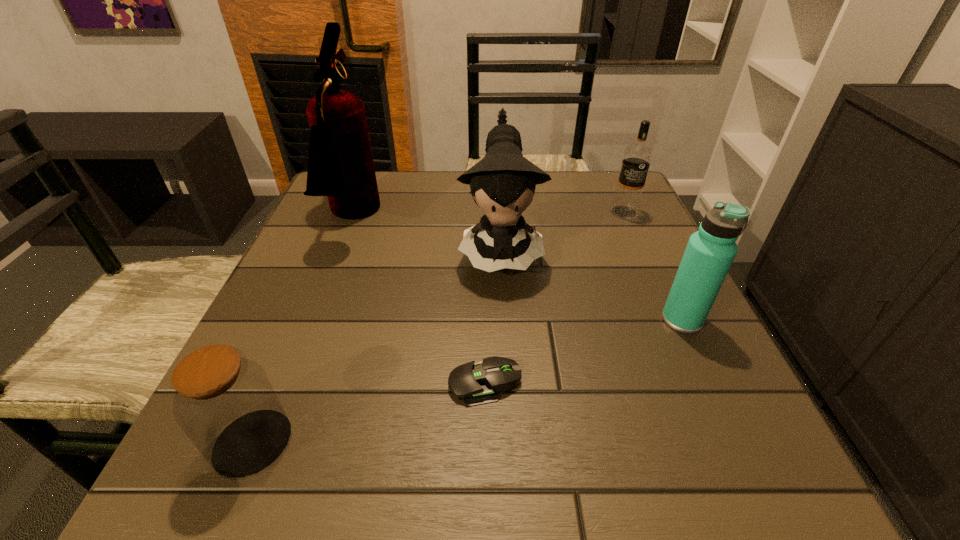
Where is `fire extinguisher`? The image size is (960, 540). fire extinguisher is located at coordinates (340, 165).

Locate an element on the screen. This screenshot has width=960, height=540. doll is located at coordinates (503, 182).

The height and width of the screenshot is (540, 960). In order to click on the third nearest object in this screenshot , I will do `click(709, 254)`.

I want to click on vodka, so click(637, 157).

Locate an element on the screen. This screenshot has height=540, width=960. the nearest object is located at coordinates (224, 402).

At what (x,y) coordinates should I click in order to perform the action: click on the fifth tallest object. Please return your answer as a coordinate pair (x, y). The width and height of the screenshot is (960, 540). Looking at the image, I should click on (224, 402).

At what (x,y) coordinates should I click in order to perform the action: click on the shortest object. Please return your answer as a coordinate pair (x, y). Looking at the image, I should click on (475, 383).

Locate an element on the screen. The height and width of the screenshot is (540, 960). computer mouse is located at coordinates point(475,383).

Locate an element on the screen. This screenshot has width=960, height=540. free region located 0.350m at the nozzle of the fire extinguisher is located at coordinates (525, 217).

Where is `vacant space located 0.370m at the face of the doll`? vacant space located 0.370m at the face of the doll is located at coordinates (514, 480).